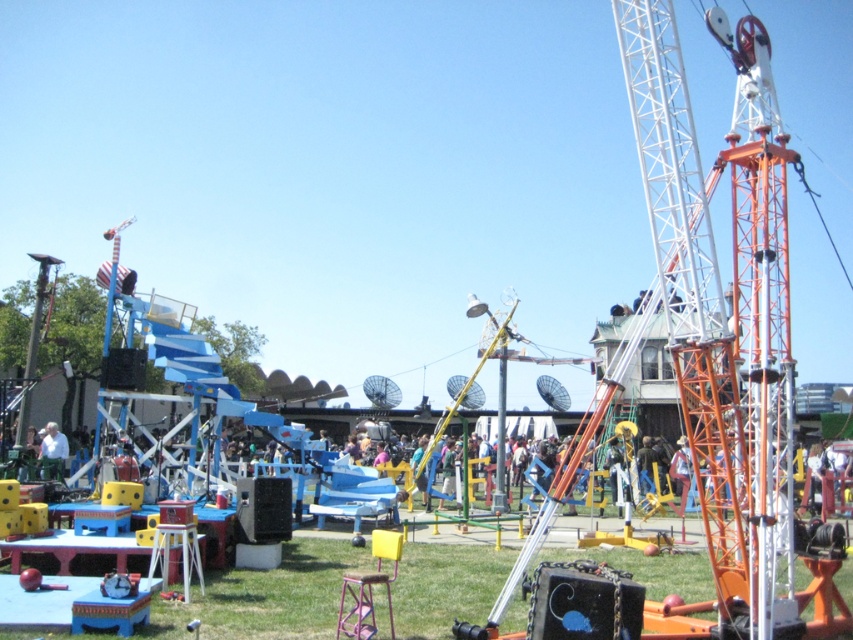
Question: Does orange metallic crane at right appear on the left side of light blue shirt at lower left?

Choices:
 (A) yes
 (B) no

Answer: (B)

Question: Is orange metallic crane at right smaller than light blue shirt at lower left?

Choices:
 (A) yes
 (B) no

Answer: (B)

Question: Is orange metallic crane at right smaller than light blue shirt at lower left?

Choices:
 (A) yes
 (B) no

Answer: (B)